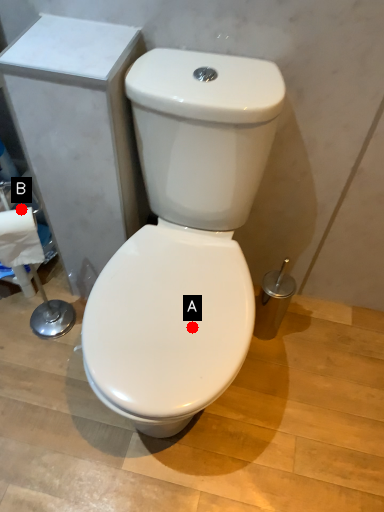
Question: Two points are circled on the image, labeled by A and B beside each circle. Which of the following is the farthest from the observer?

Choices:
 (A) A is further
 (B) B is further

Answer: (B)